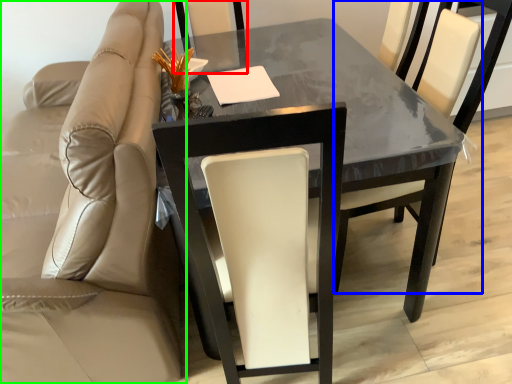
Question: Which is farther away from chair (highlighted by a red box)? chair (highlighted by a blue box) or chair (highlighted by a green box)?

Choices:
 (A) chair
 (B) chair

Answer: (A)